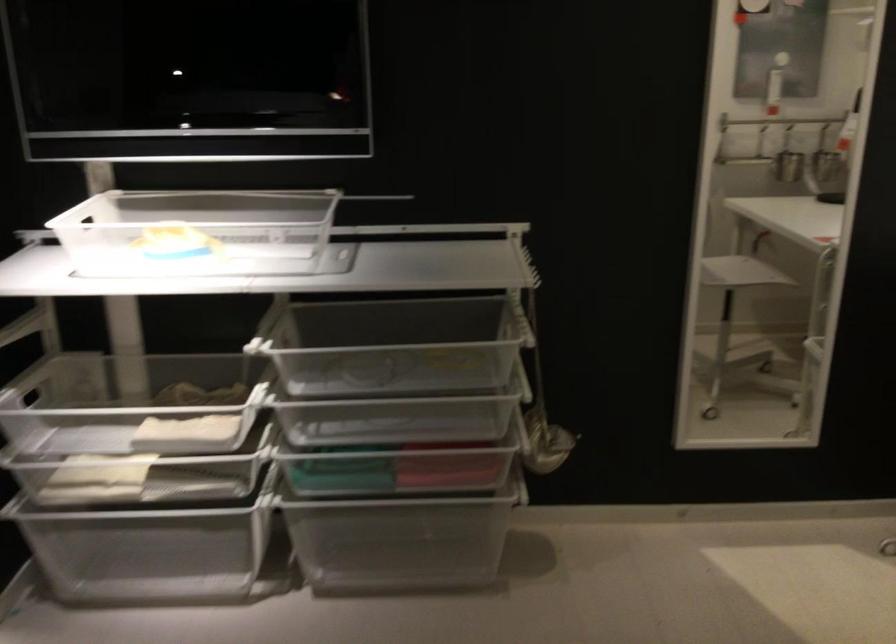
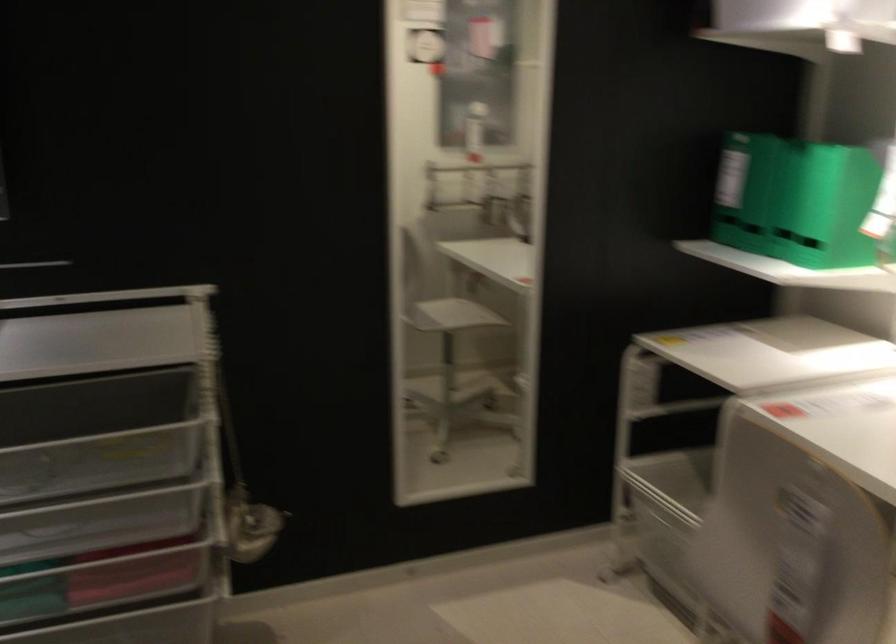
Question: The images are taken continuously from a first-person perspective. In which direction is your viewpoint rotating?

Choices:
 (A) Left
 (B) Right
 (C) Up
 (D) Down

Answer: (B)